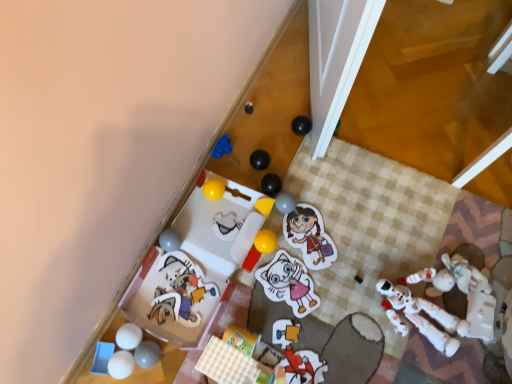
Where is `vacant space that's between white rubber ball at lower left, which is the fourteenth toy from right to left, and white plastic toy at lower right, the fifteenth toy viewed from the left`? vacant space that's between white rubber ball at lower left, which is the fourteenth toy from right to left, and white plastic toy at lower right, the fifteenth toy viewed from the left is located at coordinates (307, 329).